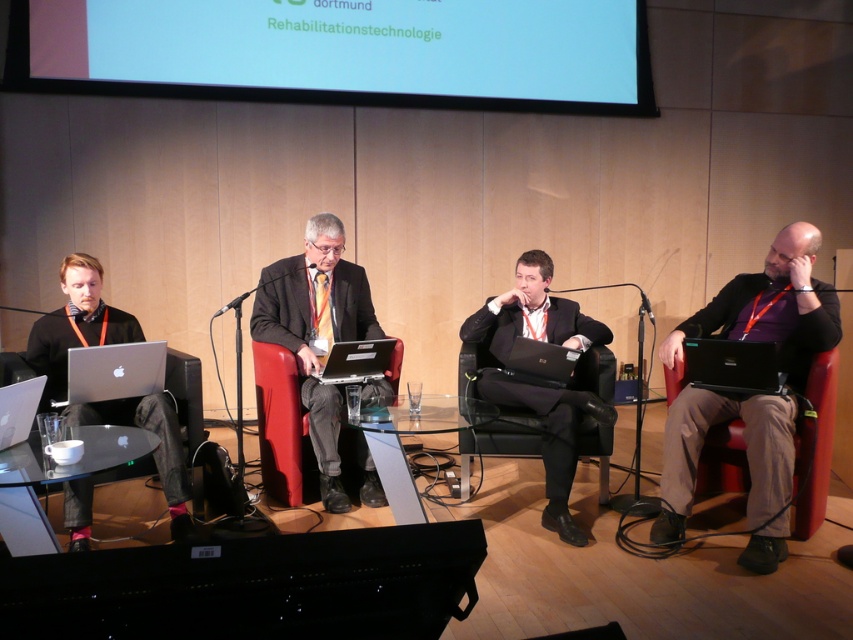
Question: Is silver metallic laptop at lower left further to the viewer compared to metallic silver microphone at center?

Choices:
 (A) no
 (B) yes

Answer: (A)

Question: Among these objects, which one is nearest to the camera?

Choices:
 (A) red leather chair at center
 (B) black leather chair at center
 (C) silver metallic laptop at left
 (D) red leather chair at right

Answer: (C)

Question: Is the position of red leather chair at right less distant than that of silver metallic laptop at center?

Choices:
 (A) yes
 (B) no

Answer: (A)

Question: Does red leather chair at center have a greater width compared to black glossy laptop at right?

Choices:
 (A) no
 (B) yes

Answer: (A)

Question: Which of the following is the closest to the observer?

Choices:
 (A) (67, 289)
 (B) (645, 307)
 (C) (1, 397)

Answer: (C)

Question: Which point is closer to the camera?

Choices:
 (A) (796, 429)
 (B) (158, 448)

Answer: (B)